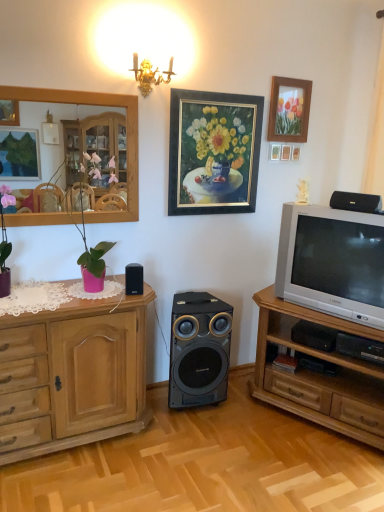
This screenshot has height=512, width=384. I want to click on free space in front of black plastic speaker at center, acting as the first loudspeaker starting from the back, so click(x=201, y=431).